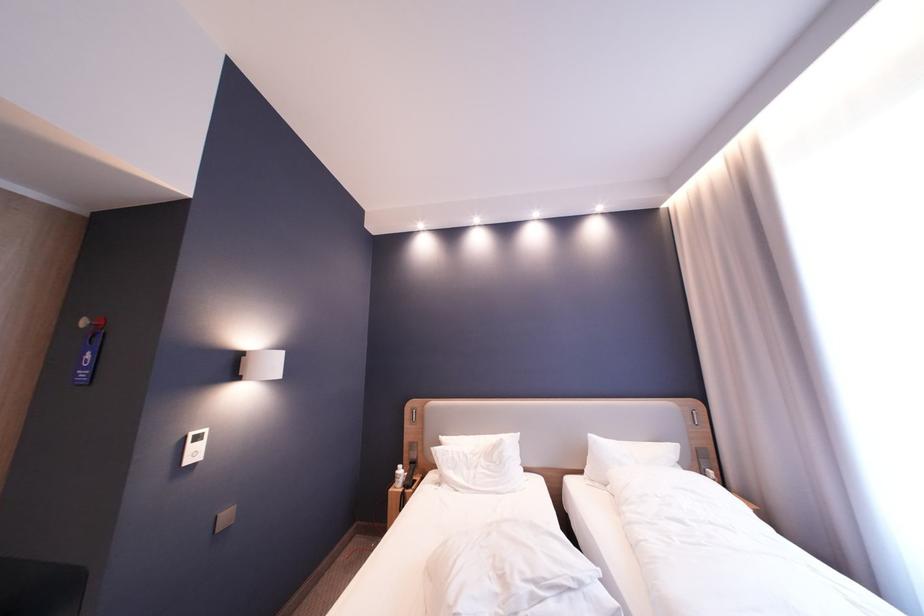
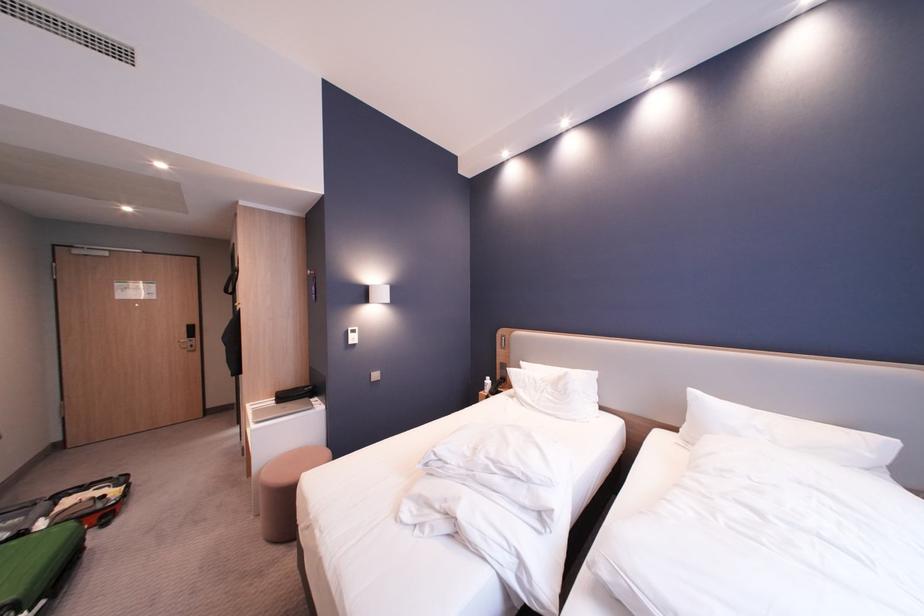
Question: The camera is either moving clockwise (left) or counter-clockwise (right) around the object. The first image is from the beginning of the video and the second image is from the end. Is the camera moving left or right when shooting the video?

Choices:
 (A) Left
 (B) Right

Answer: (B)